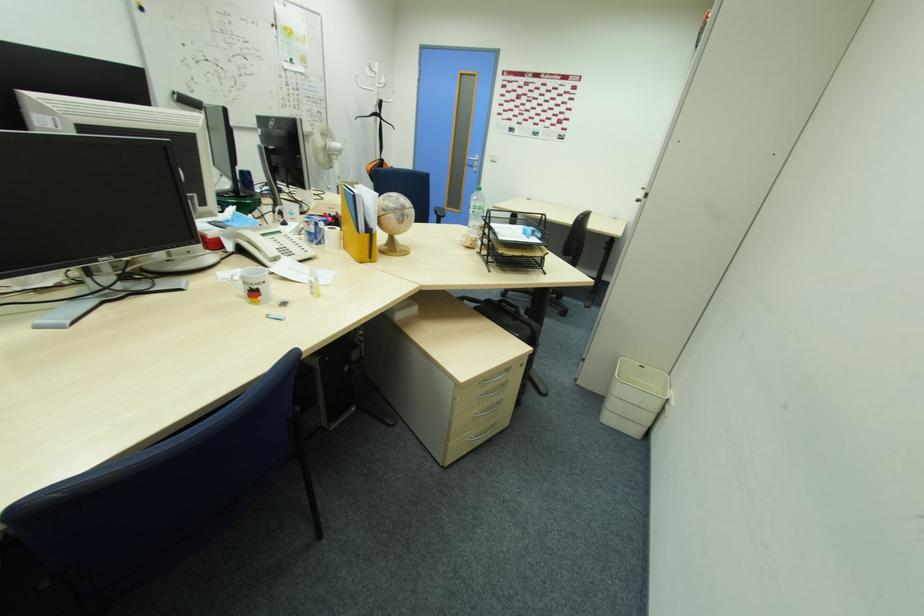
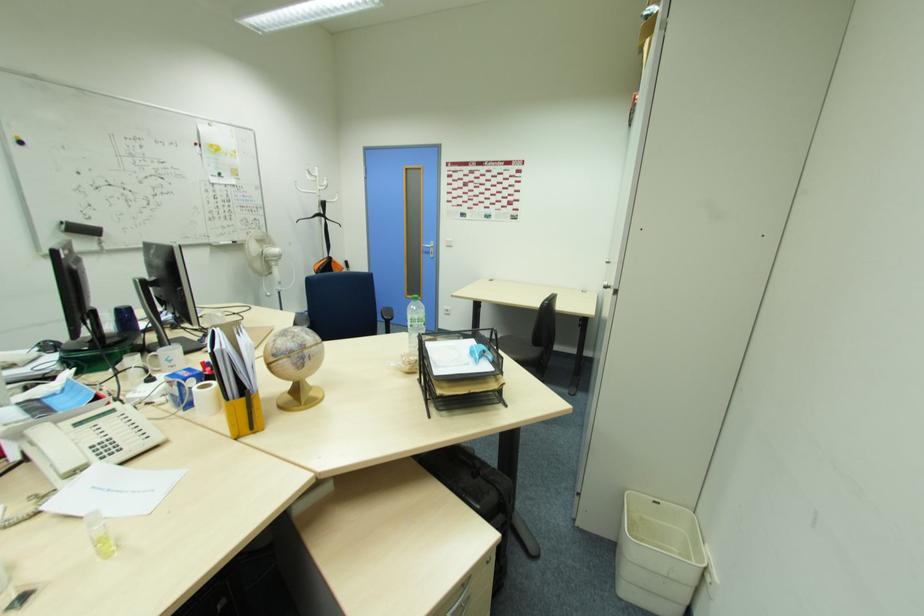
In the second image, find the point that corresponds to (310,215) in the first image.

(209, 351)